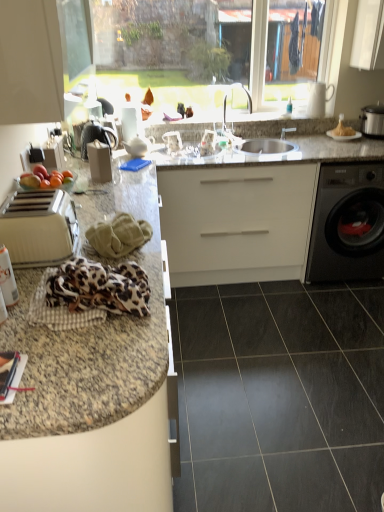
Locate an element on the screen. free space above white glossy plate at upper right (from a real-world perspective) is located at coordinates (346, 128).